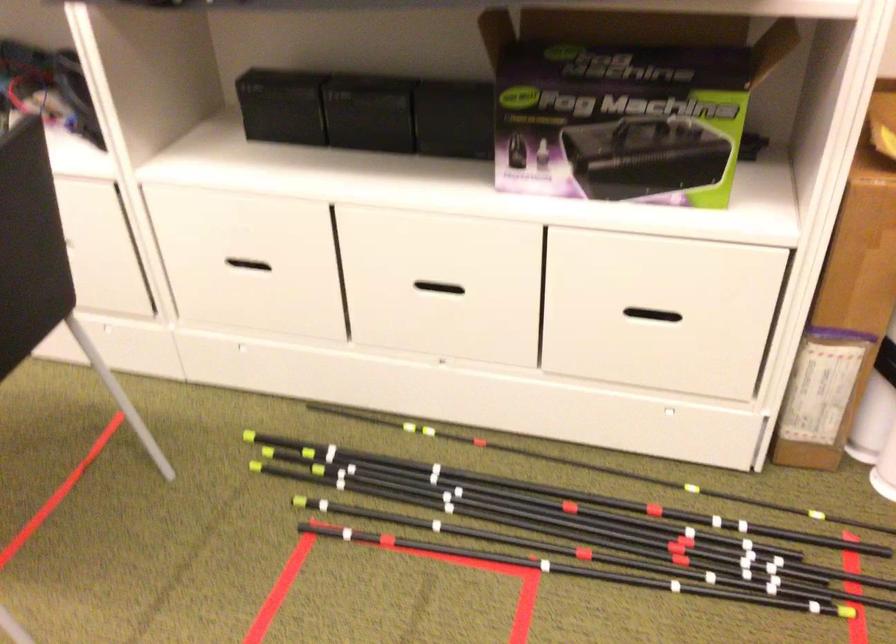
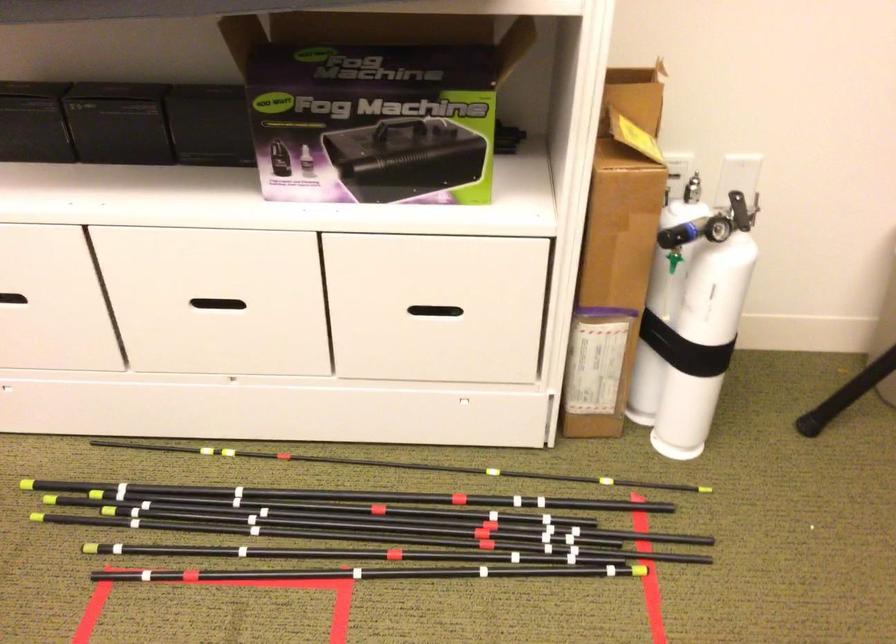
Question: Which direction would the cameraman need to move to produce the second image? Reply with the corresponding letter.

Choices:
 (A) Left
 (B) Right
 (C) Forward
 (D) Backward

Answer: (B)